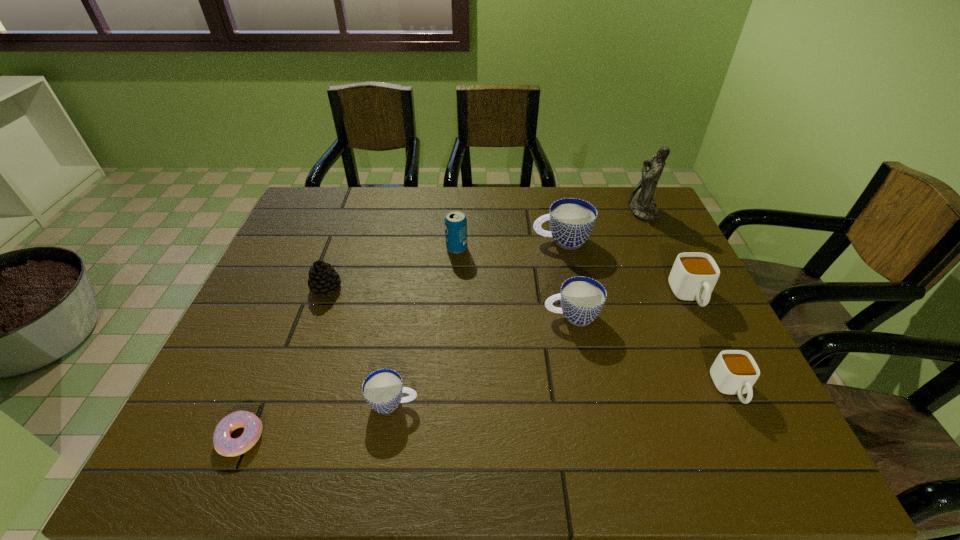
I want to click on figurine, so click(x=641, y=203).

The width and height of the screenshot is (960, 540). In order to click on the tallest object in this screenshot , I will do `click(641, 203)`.

Identify the location of blue soda can. (455, 221).

Where is `the sixth object from right to left`? the sixth object from right to left is located at coordinates (455, 221).

You are a GUI agent. You are given a task and a screenshot of the screen. Output one action in this format:
    pyautogui.click(x=<x>, y=<y>)
    Task: Click on the biggest blue cup
    The height and width of the screenshot is (540, 960).
    Given the screenshot: What is the action you would take?
    pyautogui.click(x=572, y=220)

The image size is (960, 540). What are the coordinates of `the farthest cup` in the screenshot? It's located at (572, 220).

Where is `the bigger white cup`? The height and width of the screenshot is (540, 960). the bigger white cup is located at coordinates (693, 277).

The width and height of the screenshot is (960, 540). Identify the location of pinecone. (323, 278).

Find the location of a particular element. The image size is (960, 540). the second biggest blue cup is located at coordinates (582, 298).

Locate an element on the screen. the smaller white cup is located at coordinates pos(734,371).